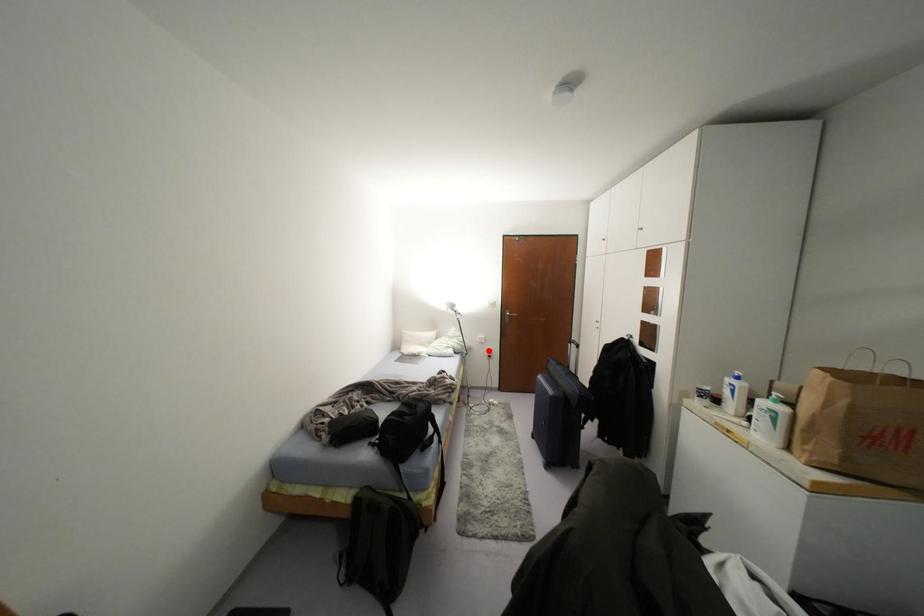
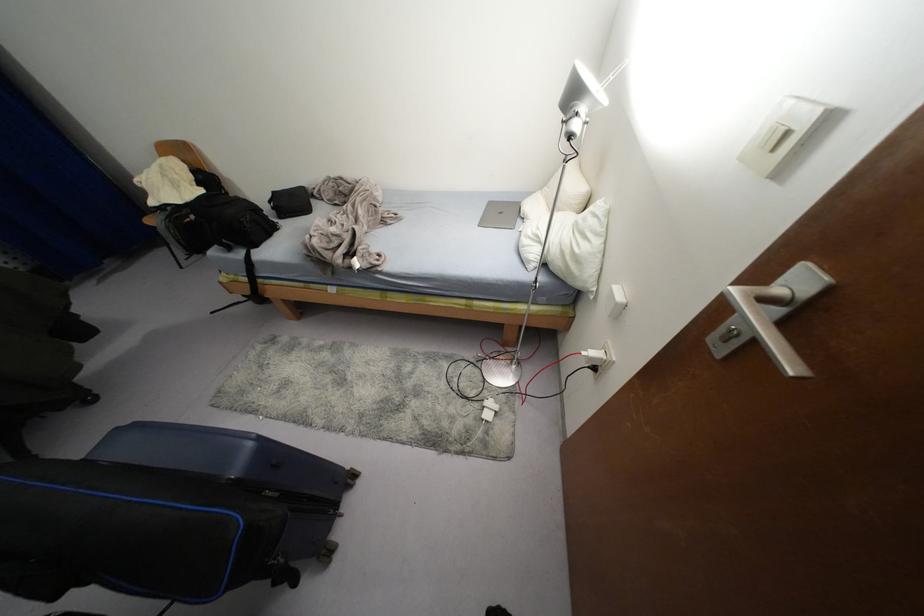
Question: I am providing you with two images of the same scene from different viewpoints. Image1 has a red point marked. In image2, the corresponding 3D location appears at what relative position? Reply with the corresponding letter.

Choices:
 (A) Closer
 (B) Farther

Answer: (A)